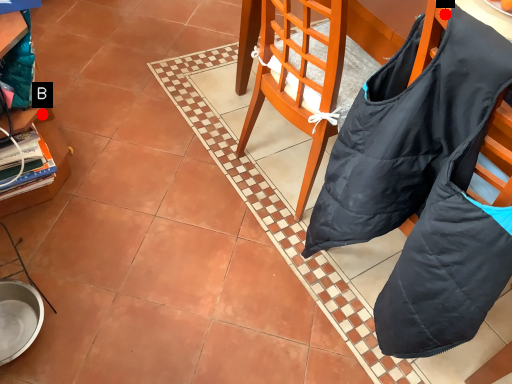
Question: Two points are circled on the image, labeled by A and B beside each circle. Which point is closer to the camera?

Choices:
 (A) A is closer
 (B) B is closer

Answer: (A)